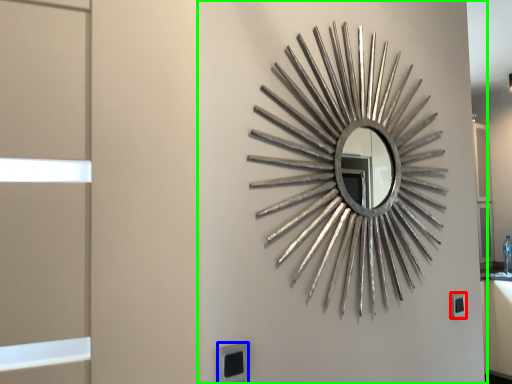
Question: Which is nearer to the electric outlet (highlighted by a red box)? electric outlet (highlighted by a blue box) or backdrop (highlighted by a green box).

Choices:
 (A) electric outlet
 (B) backdrop

Answer: (B)